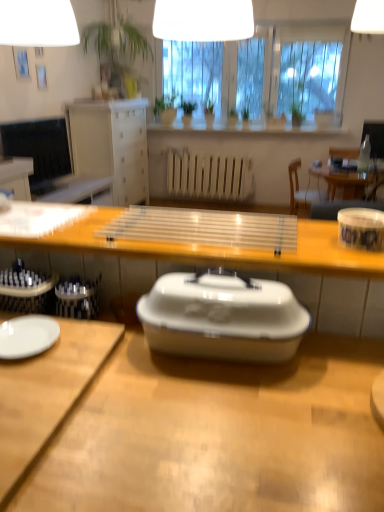
Question: Is matte white vase at upper center taller or shorter than transparent plastic tray at center, the first desk from the top?

Choices:
 (A) tall
 (B) short

Answer: (A)

Question: Which is correct: matte white vase at upper center is inside transparent plastic tray at center, placed as the 3th desk when sorted from bottom to top, or outside of it?

Choices:
 (A) inside
 (B) outside

Answer: (B)

Question: Which is farther from the white plastic chair at right?

Choices:
 (A) white glossy sink at center
 (B) white glossy mug at right
 (C) green leafy plant at center, which ranks as the 5th houseplant in left-to-right order
 (D) white glossy plate at lower left
 (E) matte white vase at upper center

Answer: (D)

Question: Considering the real-world distances, which object is farthest from the white glossy lampshade at upper center?

Choices:
 (A) white glossy trash bin/can at lower left, the second trash bin/can from the right
 (B) black glossy television at upper left
 (C) green leafy plant at upper left, which appears as the 1th houseplant when viewed from the left
 (D) wooden desk at lower left, which is the second desk in top-to-bottom order
 (E) white glossy trash bin/can at lower left, placed as the second trash bin/can when sorted from left to right

Answer: (C)